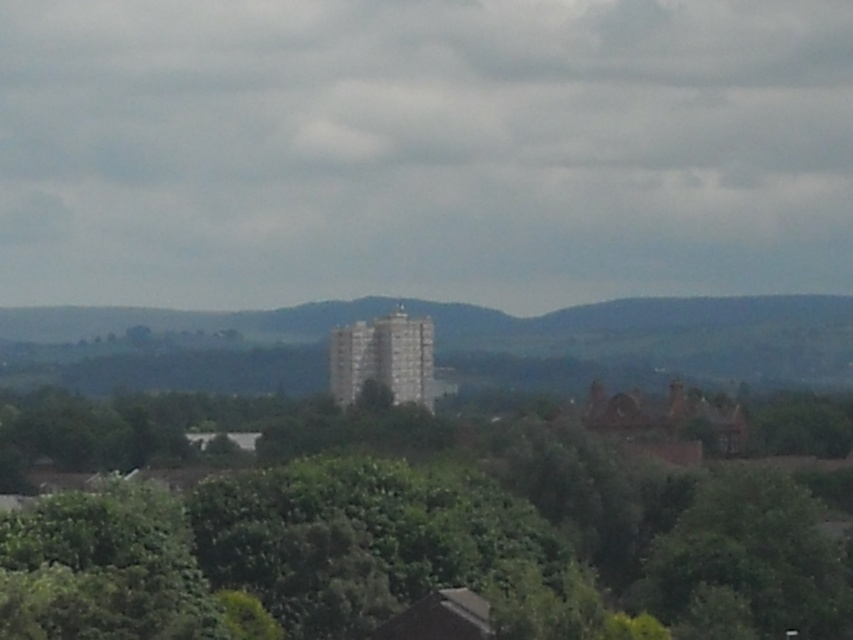
Which is in front, point (283, 401) or point (526, 326)?

Positioned in front is point (283, 401).

Between green leafy tree at center and green textured hill at center, which one is positioned higher?

green textured hill at center is above.

Who is more distant from viewer, (302,404) or (134,349)?

Positioned behind is point (134,349).

Find the location of `green leafy tree at center`. green leafy tree at center is located at coordinates (430, 536).